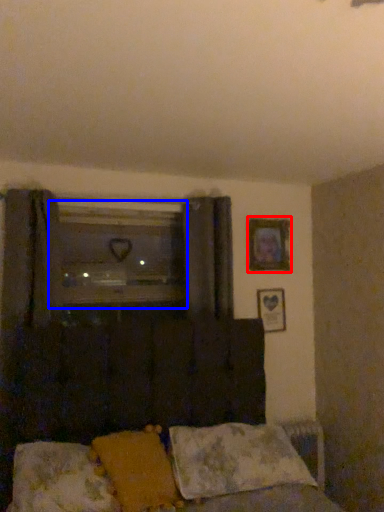
Question: Among these objects, which one is farthest to the camera, picture frame (highlighted by a red box) or window (highlighted by a blue box)?

Choices:
 (A) picture frame
 (B) window

Answer: (A)